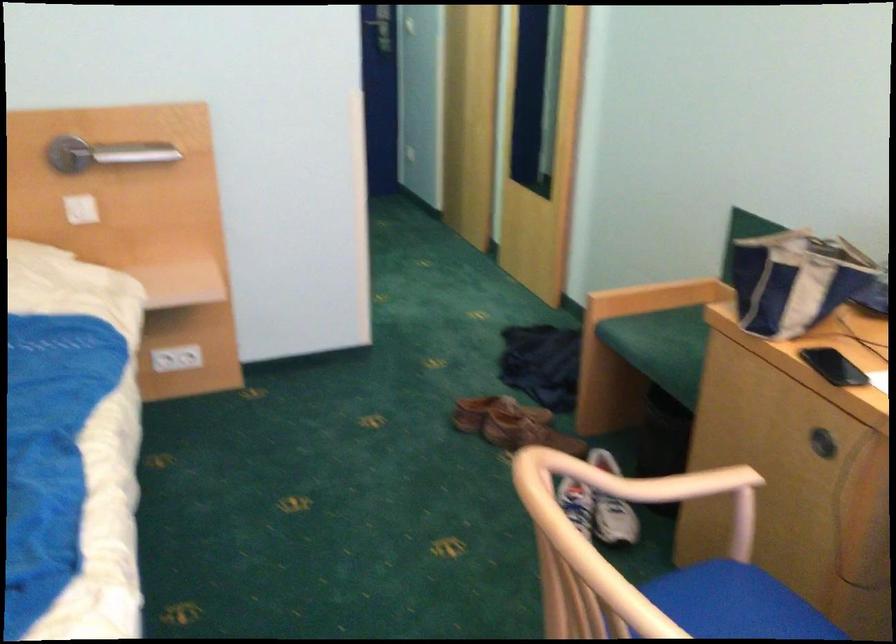
Find where to push the metal lever handle. Please return your answer as a coordinate pair (x, y).

(105, 154)